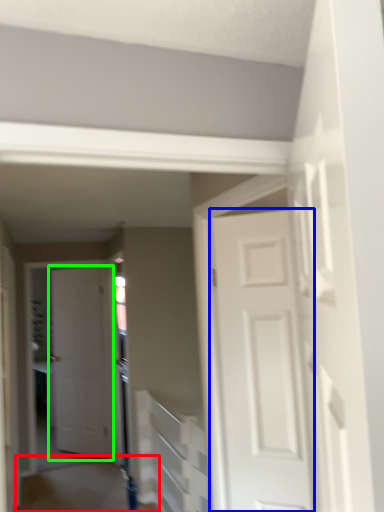
Question: Based on their relative distances, which object is nearer to path (highlighted by a red box)? Choose from door (highlighted by a blue box) and door (highlighted by a green box).

Choices:
 (A) door
 (B) door

Answer: (B)